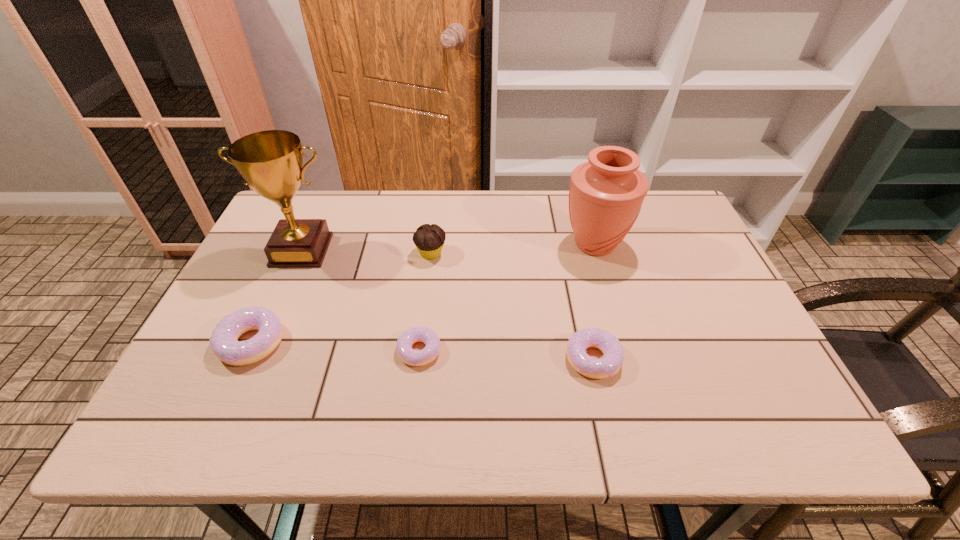
I want to click on unoccupied area between the fifth shortest object and the leftmost doughnut, so click(423, 294).

The width and height of the screenshot is (960, 540). I want to click on free space between the shortest doughnut and the third shortest object, so click(x=336, y=347).

At what (x,y) coordinates should I click in order to perform the action: click on unoccupied position between the award and the fourth shortest object. Please return your answer as a coordinate pair (x, y). The image size is (960, 540). Looking at the image, I should click on (367, 252).

I want to click on free area in between the rightmost doughnut and the second tallest object, so click(x=594, y=301).

Where is `object that stands as the closest to the muffin`? object that stands as the closest to the muffin is located at coordinates (270, 161).

Identify which object is located as the fifth nearest to the tallest doughnut. Please provide its 2D coordinates. Your answer should be formatted as a tuple, i.e. [(x, y)], where the tuple contains the x and y coordinates of a point satisfying the conditions above.

[(606, 193)]

Identify which doughnut is located as the second nearest to the fourth tallest object. Please provide its 2D coordinates. Your answer should be formatted as a tuple, i.e. [(x, y)], where the tuple contains the x and y coordinates of a point satisfying the conditions above.

[(608, 365)]

The width and height of the screenshot is (960, 540). In order to click on doughnut that can be found as the second closest to the muffin in this screenshot , I will do `click(224, 342)`.

I want to click on free spot that satisfies the following two spatial constraints: 1. on the back side of the tallest doughnut; 2. on the left side of the fifth shortest object, so click(x=298, y=245).

This screenshot has width=960, height=540. Find the location of `vacant space that satisfies the following two spatial constraints: 1. on the front side of the second tallest doughnut; 2. on the left side of the leftmost doughnut`. vacant space that satisfies the following two spatial constraints: 1. on the front side of the second tallest doughnut; 2. on the left side of the leftmost doughnut is located at coordinates (245, 359).